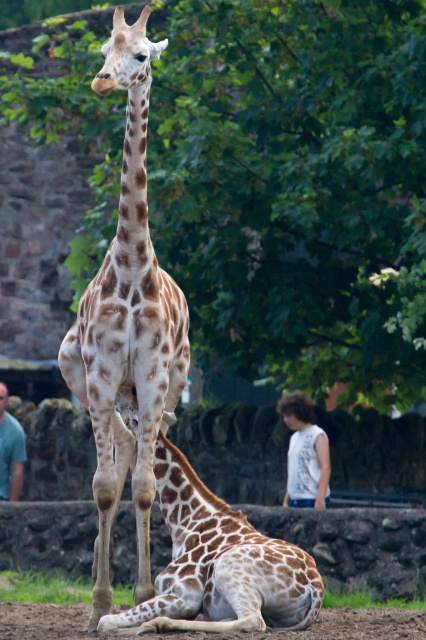
Can you confirm if white sleeveless shirt at lower right is thinner than blue shirt at lower left?

No, white sleeveless shirt at lower right is not thinner than blue shirt at lower left.

Consider the image. Between white sleeveless shirt at lower right and blue shirt at lower left, which one is positioned higher?

Positioned higher is white sleeveless shirt at lower right.

Does point (310, 426) come closer to viewer compared to point (14, 467)?

Yes, point (310, 426) is closer to viewer.

Image resolution: width=426 pixels, height=640 pixels. What are the coordinates of `white sleeveless shirt at lower right` in the screenshot? It's located at (305, 454).

Is brown soil at lower center positioned before blue shirt at lower left?

Yes, it is in front of blue shirt at lower left.

In the scene shown: Does brown soil at lower center appear over blue shirt at lower left?

No.

Between point (322, 637) and point (0, 420), which one is positioned behind?

Positioned behind is point (0, 420).

You are a GUI agent. You are given a task and a screenshot of the screen. Output one action in this format:
    pyautogui.click(x=<x>, y=<y>)
    Task: Click on the brown soil at lower center
    
    Given the screenshot: What is the action you would take?
    pyautogui.click(x=215, y=634)

Is spotted fur giraffe at center closer to camera compared to brown soil at lower center?

Yes, it is in front of brown soil at lower center.

Who is positioned more to the right, spotted fur giraffe at center or brown soil at lower center?

From the viewer's perspective, brown soil at lower center appears more on the right side.

Is point (146, 273) behind point (362, 637)?

No, it is not.

The height and width of the screenshot is (640, 426). I want to click on spotted fur giraffe at center, so click(x=126, y=324).